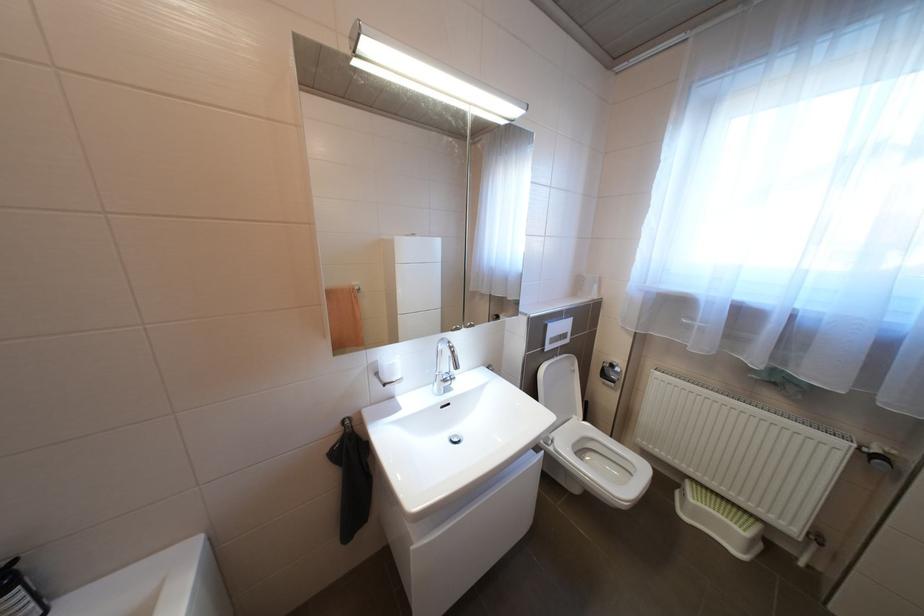
Where would you push the toilet flush button? Please return your answer as a coordinate pair (x, y).

(556, 334)